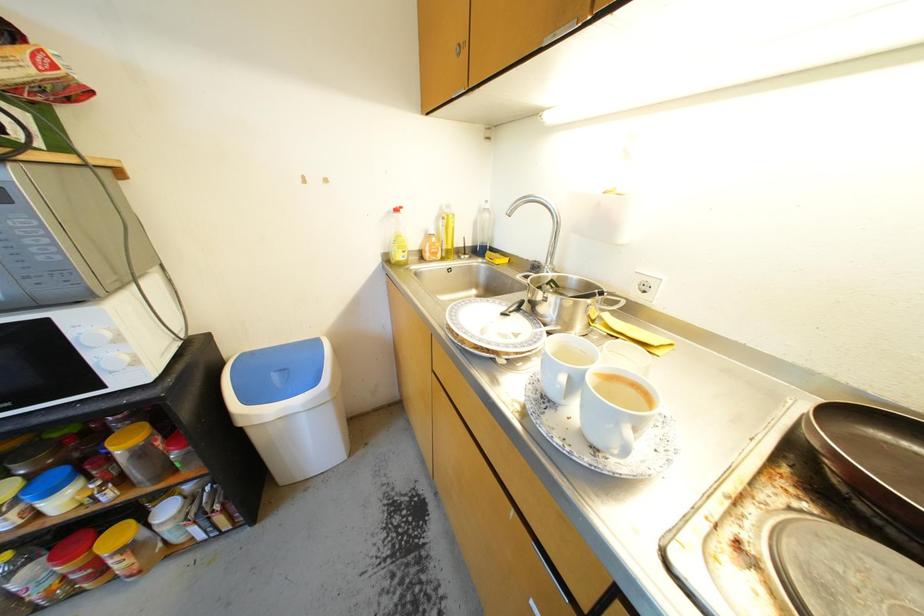
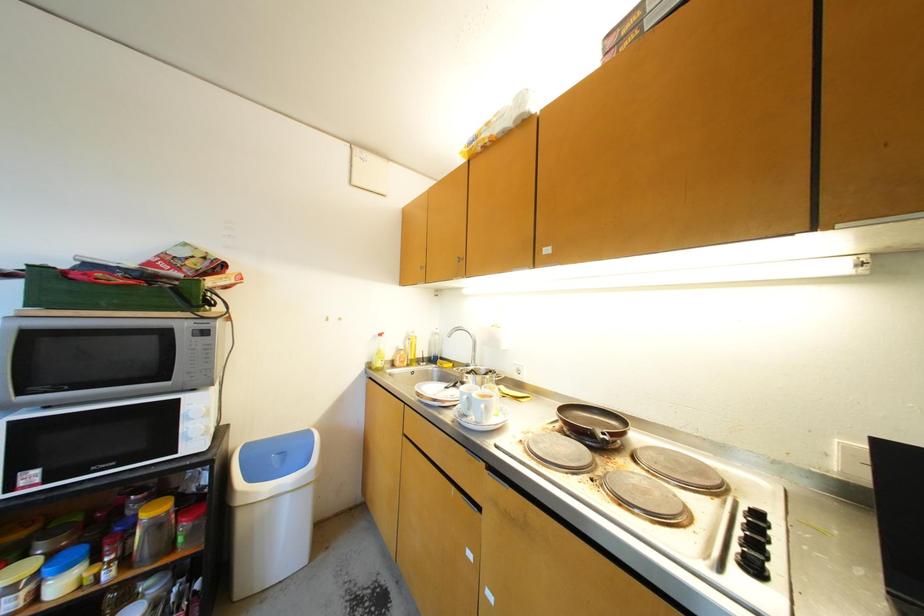
Question: The images are taken continuously from a first-person perspective. In which direction are you moving?

Choices:
 (A) Left
 (B) Right
 (C) Forward
 (D) Backward

Answer: (D)